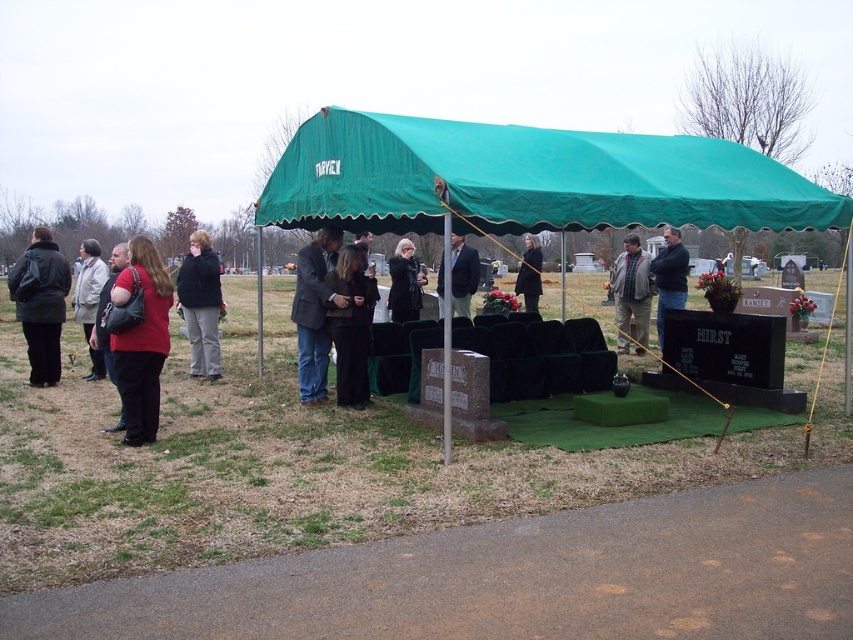
You are attending a funeral at the cemetery and see two items hanging on a rack under the green canopy tent. The items are the black fabric coat at center and the dark blue jacket at center. Which one is hanging lower on the rack?

The black fabric coat at center is located below the dark blue jacket at center, so it is hanging lower on the rack.

What is the 2D coordinate of the green fabric tent at center in the image?

The 2D coordinate of the green fabric tent at center is at point (527, 179).

Based on the scene description, if you are standing facing the green fabric tent at center, where would the gray wool jacket at center be located relative to your position?

The gray wool jacket at center is to the right of the green fabric tent at center.